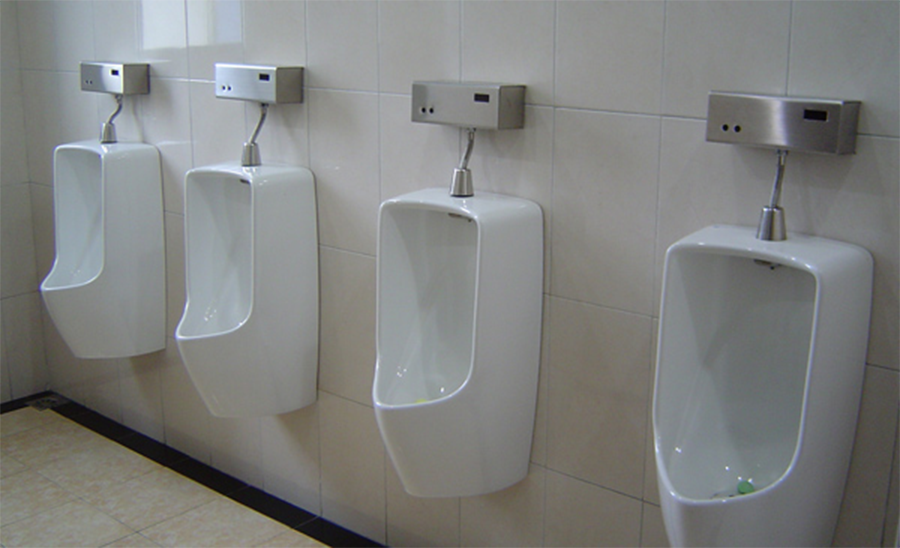
I want to click on automatic flushers, so click(x=102, y=81), click(x=262, y=95), click(x=459, y=111), click(x=780, y=128).